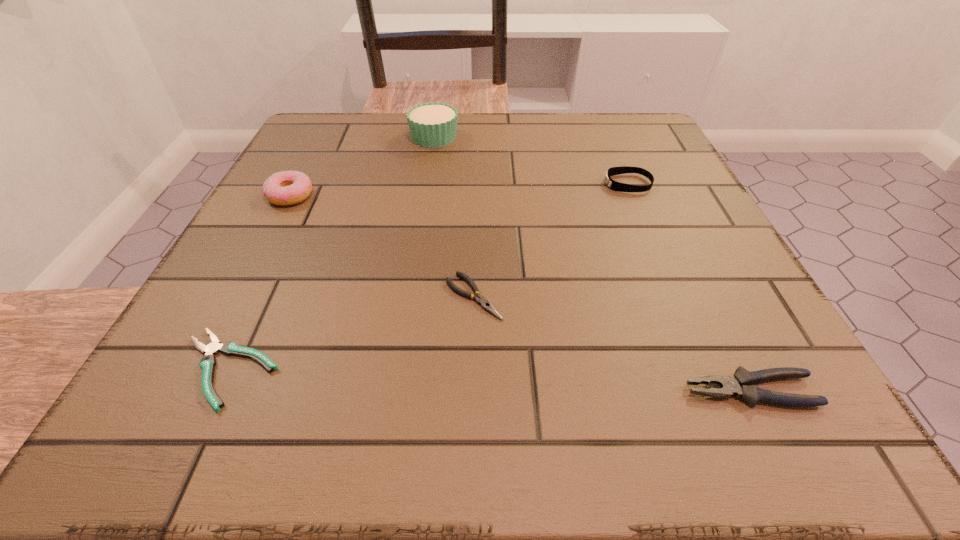
This screenshot has height=540, width=960. In order to click on doughnut located at the left edge in this screenshot , I will do `click(283, 188)`.

Locate an element on the screen. pliers at the left edge is located at coordinates coord(208,362).

Find the location of a particular element. This screenshot has width=960, height=540. wristband positioned at the right edge is located at coordinates (613, 185).

Where is `pliers present at the right edge`? pliers present at the right edge is located at coordinates (739, 384).

This screenshot has width=960, height=540. What are the coordinates of `object that is at the near left corner` in the screenshot? It's located at (208, 362).

You are a GUI agent. You are given a task and a screenshot of the screen. Output one action in this format:
    pyautogui.click(x=<x>, y=<y>)
    Task: Click on the object that is at the near right corner
    This screenshot has height=540, width=960.
    Given the screenshot: What is the action you would take?
    pyautogui.click(x=739, y=384)

The image size is (960, 540). In the image, there is a desktop. What are the coordinates of `vacant space at the far edge` in the screenshot? It's located at (501, 145).

This screenshot has width=960, height=540. In order to click on free location at the near edge in this screenshot , I will do `click(352, 421)`.

Where is `vacant region at the left edge of the desktop`? The width and height of the screenshot is (960, 540). vacant region at the left edge of the desktop is located at coordinates (291, 350).

What are the coordinates of `free space at the right edge` in the screenshot? It's located at (739, 312).